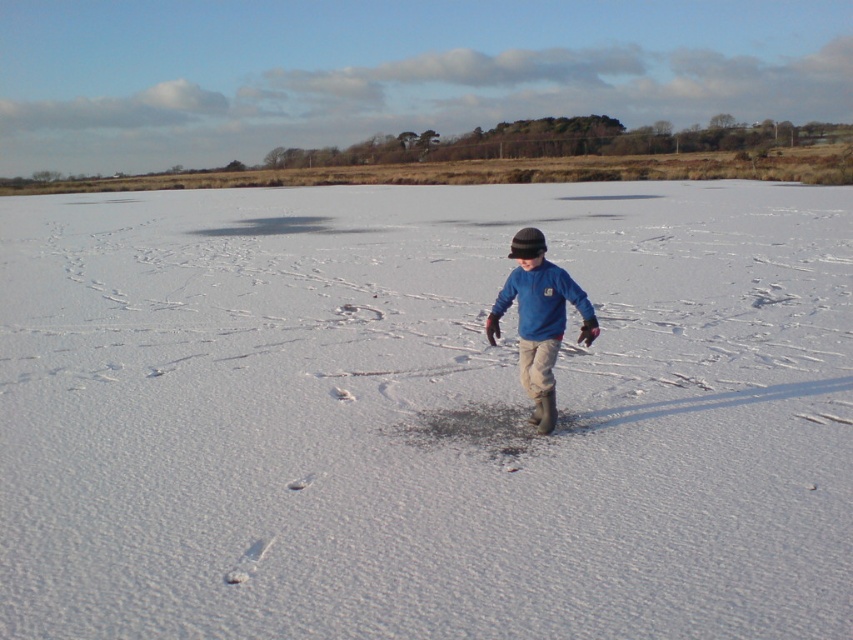
Question: Does white powdery snow at center lie in front of blue fleece at center?

Choices:
 (A) yes
 (B) no

Answer: (A)

Question: Which point is closer to the camera?

Choices:
 (A) blue fleece at center
 (B) white powdery snow at center
 (C) blue fleece jacket at center

Answer: (B)

Question: Which object appears farthest from the camera in this image?

Choices:
 (A) white powdery snow at center
 (B) blue fleece jacket at center
 (C) blue fleece at center

Answer: (B)

Question: Can you confirm if white powdery snow at center is positioned below blue fleece jacket at center?

Choices:
 (A) no
 (B) yes

Answer: (A)

Question: Which object is the farthest from the blue fleece at center?

Choices:
 (A) white powdery snow at center
 (B) blue fleece jacket at center

Answer: (A)

Question: In this image, where is white powdery snow at center located relative to blue fleece jacket at center?

Choices:
 (A) left
 (B) right

Answer: (A)